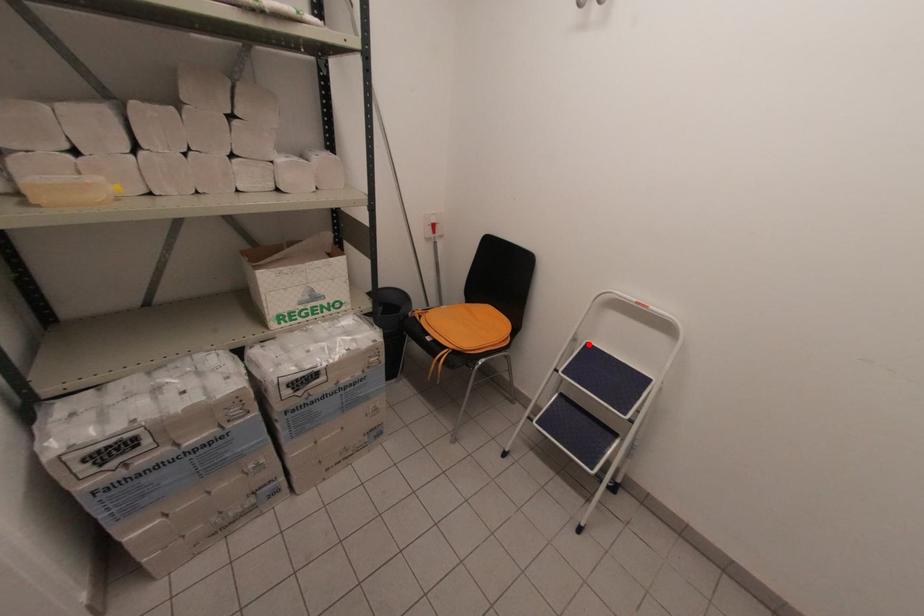
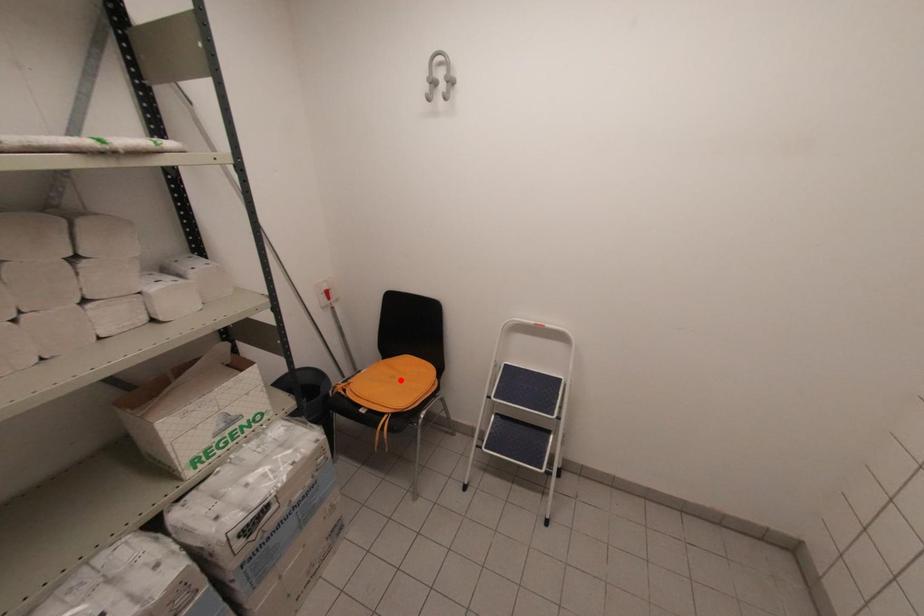
I am providing you with two images of the same scene from different viewpoints. A red point is marked on the first image and another point is marked on the second image. Is the red point in image1 aligned with the point shown in image2?

No